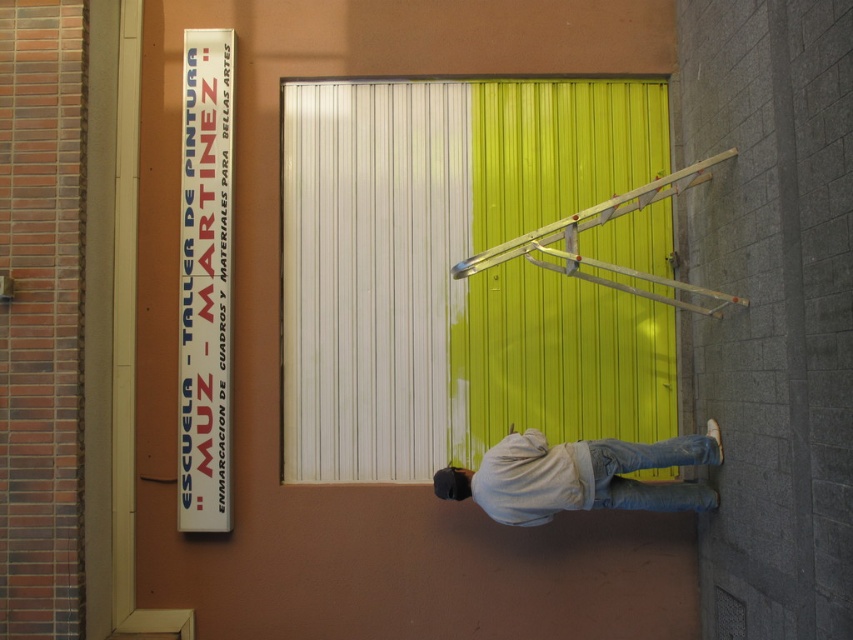
You are a painter standing at the point indicated by the coordinates point [579,476]. You want to paint the left side of the shutter. Which direction should you move to reach the unpainted area?

The point [579,476] indicates the light gray cotton shirt at lower right, which is positioned at the bottom right corner of the shutter. To reach the unpainted left side of the shutter, you should move to the left.

You are a painter who needs to move the metallic silver ladder at center closer to the light gray cotton shirt at lower right to reach a higher area. Is the ladder currently positioned far enough away from the shirt to allow you to move it without stepping on the shirt?

The metallic silver ladder at center is positioned at center, while the light gray cotton shirt at lower right is at lower right. Since the ladder is centrally located and the shirt is at the lower right corner, there is sufficient space between them to move the ladder closer without stepping on the shirt.